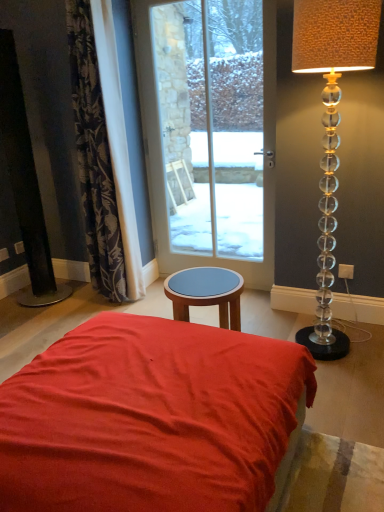
Question: Do you think clear glass door at center is within matte red fabric bed at center, or outside of it?

Choices:
 (A) outside
 (B) inside

Answer: (A)

Question: Relative to matte red fabric bed at center, is clear glass door at center in front or behind?

Choices:
 (A) behind
 (B) front

Answer: (A)

Question: Which object is positioned closest to the clear glass door at center?

Choices:
 (A) translucent glass lamp at right
 (B) dark floral fabric curtain at left
 (C) matte red fabric bed at center

Answer: (B)

Question: Estimate the real-world distances between objects in this image. Which object is farther from the matte red fabric bed at center?

Choices:
 (A) translucent glass lamp at right
 (B) clear glass door at center
 (C) dark floral fabric curtain at left

Answer: (B)